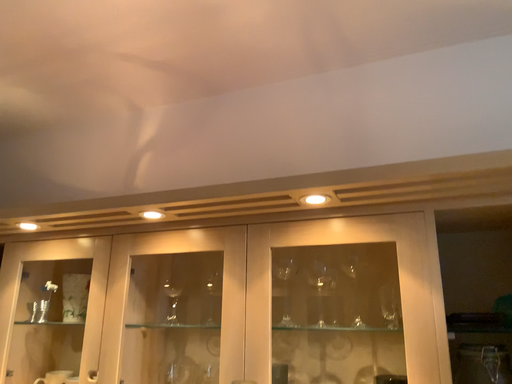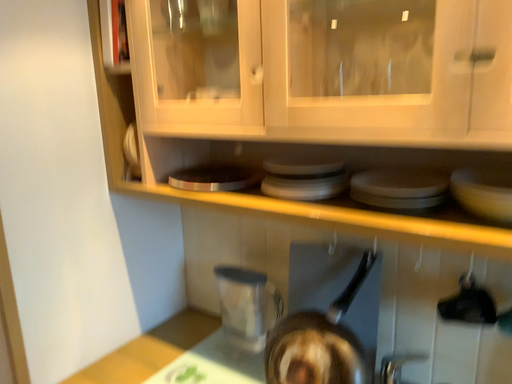
Question: How did the camera likely rotate when shooting the video?

Choices:
 (A) rotated right
 (B) rotated left

Answer: (B)